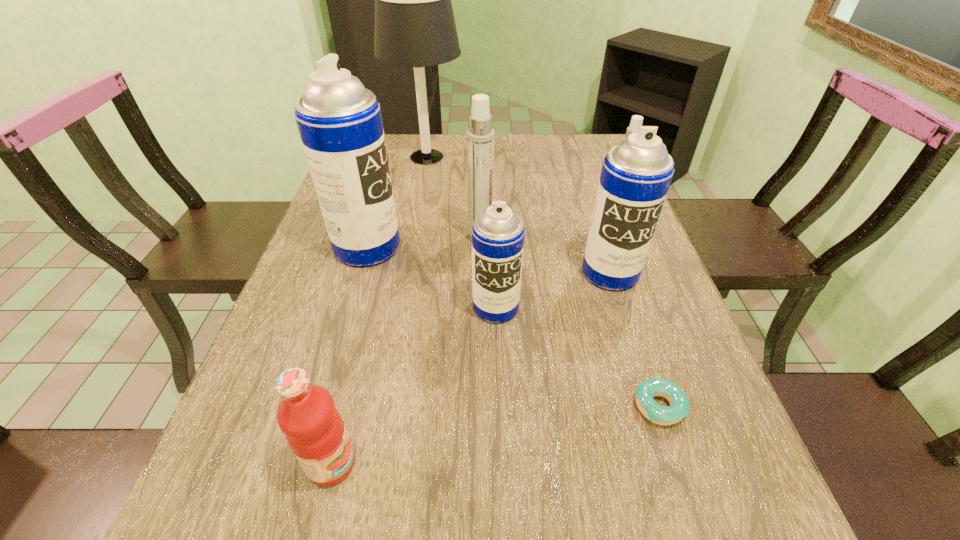
The height and width of the screenshot is (540, 960). Find the location of `object that is the seventh closest to the smallest blue aerosol can`. object that is the seventh closest to the smallest blue aerosol can is located at coordinates (415, 27).

Point out which object is positioned as the nearest to the farthest aerosol can. Please provide its 2D coordinates. Your answer should be formatted as a tuple, i.e. [(x, y)], where the tuple contains the x and y coordinates of a point satisfying the conditions above.

[(636, 174)]

Image resolution: width=960 pixels, height=540 pixels. Identify the location of the third closest aerosol can to the second blue aerosol can from right to left. (339, 121).

Find the location of a particular element. the third closest aerosol can relative to the biggest blue aerosol can is located at coordinates (636, 174).

The height and width of the screenshot is (540, 960). I want to click on blue aerosol can that is the closest to the second blue aerosol can from right to left, so click(636, 174).

In order to click on blue aerosol can that is the third closest to the bigger white aerosol can in this screenshot , I will do `click(636, 174)`.

Locate an element on the screen. The height and width of the screenshot is (540, 960). vacant area in the image that satisfies the following two spatial constraints: 1. on the label side of the second smallest blue aerosol can; 2. on the front label of the nearest object is located at coordinates (671, 464).

This screenshot has height=540, width=960. I want to click on free space in the image that satisfies the following two spatial constraints: 1. on the label side of the shortest object; 2. on the left side of the second smallest blue aerosol can, so click(x=653, y=406).

Where is `vacant area in the image that satisfies the following two spatial constraints: 1. on the label side of the tallest aerosol can; 2. on the right side of the shortest object`? vacant area in the image that satisfies the following two spatial constraints: 1. on the label side of the tallest aerosol can; 2. on the right side of the shortest object is located at coordinates (321, 406).

The image size is (960, 540). I want to click on free spot that satisfies the following two spatial constraints: 1. on the back side of the right white aerosol can; 2. on the left side of the seventh farthest object, so click(595, 212).